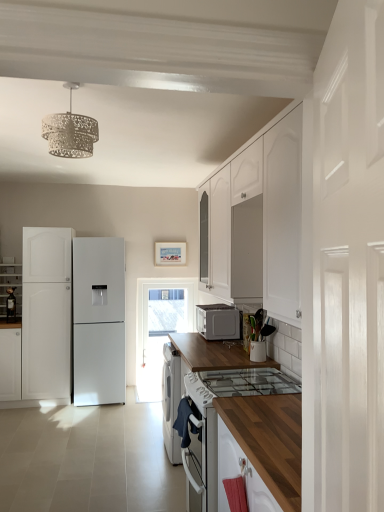
Question: Is the position of white glossy refrigerator at left, the 3th cabinetry from the right, more distant than that of white glossy door at right?

Choices:
 (A) yes
 (B) no

Answer: (A)

Question: Is white glossy refrigerator at left, the 3th cabinetry from the right, oriented towards white glossy door at right?

Choices:
 (A) no
 (B) yes

Answer: (A)

Question: Does white glossy refrigerator at left, the 3th cabinetry from the right, contain white glossy door at right?

Choices:
 (A) yes
 (B) no

Answer: (B)

Question: From a real-world perspective, is white glossy refrigerator at left, arranged as the first cabinetry when viewed from the left, below white glossy door at right?

Choices:
 (A) no
 (B) yes

Answer: (B)

Question: Is white glossy refrigerator at left, the 3th cabinetry from the right, shorter than white glossy door at right?

Choices:
 (A) no
 (B) yes

Answer: (B)

Question: From a real-world perspective, relative to white glossy door at right, is white matte cabinet at left, arranged as the 2th cabinetry when viewed from the left, vertically above or below?

Choices:
 (A) below
 (B) above

Answer: (A)

Question: Is white matte cabinet at left, arranged as the 2th cabinetry when viewed from the left, inside the boundaries of white glossy door at right, or outside?

Choices:
 (A) outside
 (B) inside

Answer: (A)

Question: Is white matte cabinet at left, arranged as the 2th cabinetry when viewed from the left, in front of or behind white glossy door at right in the image?

Choices:
 (A) front
 (B) behind

Answer: (B)

Question: Considering the positions of white matte cabinet at left, arranged as the 2th cabinetry when viewed from the left, and white glossy door at right in the image, is white matte cabinet at left, arranged as the 2th cabinetry when viewed from the left, bigger or smaller than white glossy door at right?

Choices:
 (A) big
 (B) small

Answer: (A)

Question: In terms of height, does white matte cabinet at left, the 2th cabinetry from the right, look taller or shorter compared to transparent glass door at center?

Choices:
 (A) tall
 (B) short

Answer: (B)

Question: From a real-world perspective, is white matte cabinet at left, arranged as the 2th cabinetry when viewed from the left, positioned above or below transparent glass door at center?

Choices:
 (A) above
 (B) below

Answer: (B)

Question: In terms of width, does white matte cabinet at left, arranged as the 2th cabinetry when viewed from the left, look wider or thinner when compared to transparent glass door at center?

Choices:
 (A) thin
 (B) wide

Answer: (B)

Question: From the image's perspective, is white matte cabinet at left, the 2th cabinetry from the right, positioned above or below transparent glass door at center?

Choices:
 (A) above
 (B) below

Answer: (B)

Question: In the image, is white matte cabinet at left, arranged as the 2th cabinetry when viewed from the left, positioned in front of or behind white matte refrigerator at left, the first cabinetry viewed from the right?

Choices:
 (A) front
 (B) behind

Answer: (A)

Question: From a real-world perspective, is white matte cabinet at left, the 2th cabinetry from the right, physically located above or below white matte refrigerator at left, the first cabinetry viewed from the right?

Choices:
 (A) above
 (B) below

Answer: (B)